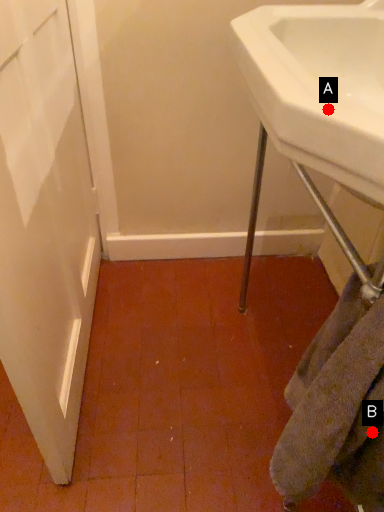
Question: Two points are circled on the image, labeled by A and B beside each circle. Among these points, which one is farthest from the camera?

Choices:
 (A) A is further
 (B) B is further

Answer: (B)